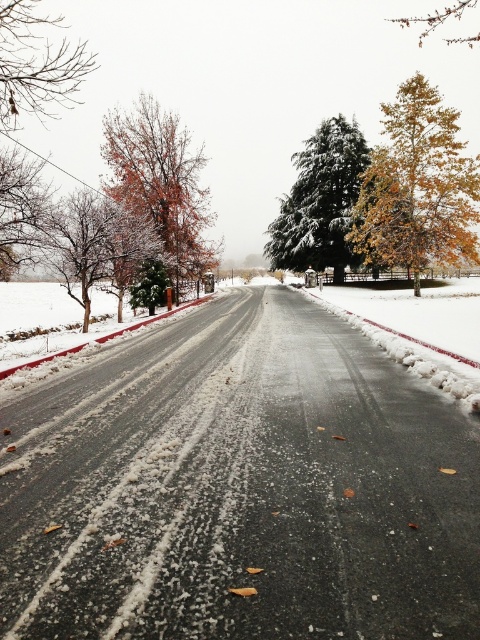
Question: Among these points, which one is nearest to the camera?

Choices:
 (A) (17, 13)
 (B) (305, 168)
 (C) (47, 195)
 (D) (107, 128)

Answer: (C)

Question: Where is brown textured tree at left located in relation to bare branches at left in the image?

Choices:
 (A) above
 (B) below

Answer: (B)

Question: Is snow-covered evergreen at center above bare branches at upper left?

Choices:
 (A) no
 (B) yes

Answer: (A)

Question: Based on their relative distances, which object is nearer to the snow-covered evergreen at center?

Choices:
 (A) orange-brown textured tree at left
 (B) bare branches at upper left
 (C) brown textured tree at left
 (D) bare branches at left

Answer: (A)

Question: Which point is farther to the camera?

Choices:
 (A) (182, 244)
 (B) (76, 257)
 (C) (472, 44)
 (D) (12, 83)

Answer: (C)

Question: Does brown textured tree at left appear over bare branches at left?

Choices:
 (A) yes
 (B) no

Answer: (B)